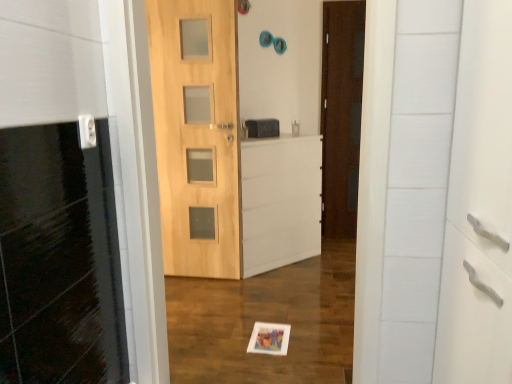
In order to click on free space in front of dark brown wood door at center, acting as the first door starting from the right in this screenshot , I will do `click(338, 241)`.